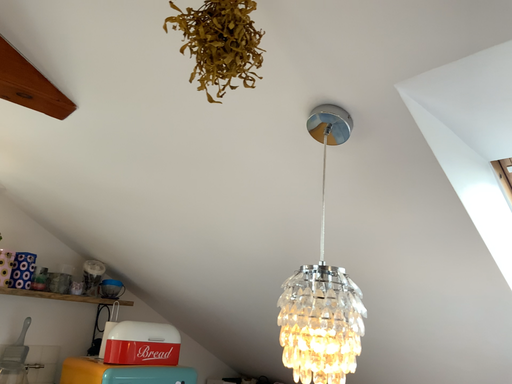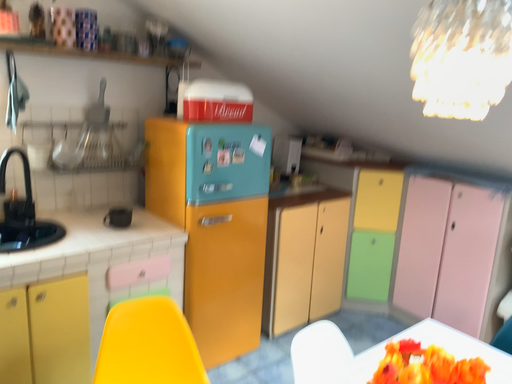
Question: Which way did the camera rotate in the video?

Choices:
 (A) rotated upward
 (B) rotated downward

Answer: (B)